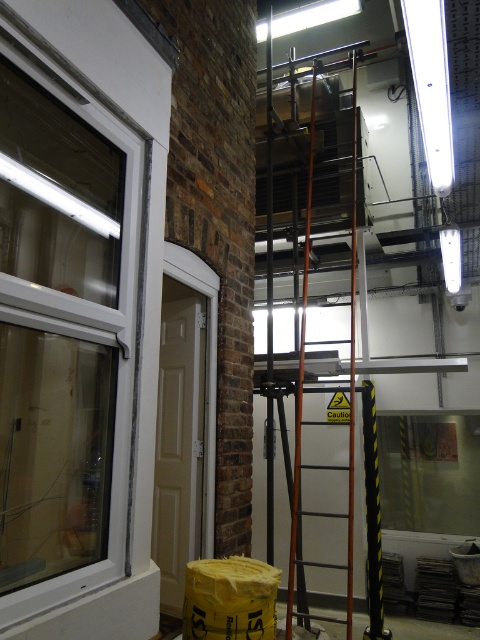
Question: Is transparent glass window at left above metallic orange ladder at center?

Choices:
 (A) no
 (B) yes

Answer: (A)

Question: Among these objects, which one is nearest to the camera?

Choices:
 (A) metallic orange ladder at center
 (B) transparent glass window at left

Answer: (B)

Question: Among these objects, which one is farthest from the camera?

Choices:
 (A) transparent glass window at left
 (B) metallic orange ladder at center

Answer: (B)

Question: Is transparent glass window at left below metallic orange ladder at center?

Choices:
 (A) no
 (B) yes

Answer: (B)

Question: Does transparent glass window at left appear over metallic orange ladder at center?

Choices:
 (A) no
 (B) yes

Answer: (A)